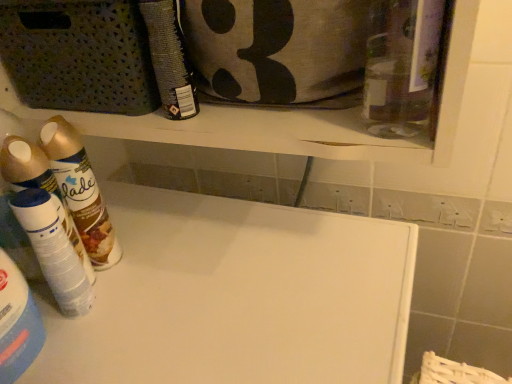
Find the location of a particular element. Image resolution: width=512 pixels, height=384 pixels. vacant space behind white plastic spray can at left, positioned as the second cleaning product in left-to-right order is located at coordinates (145, 220).